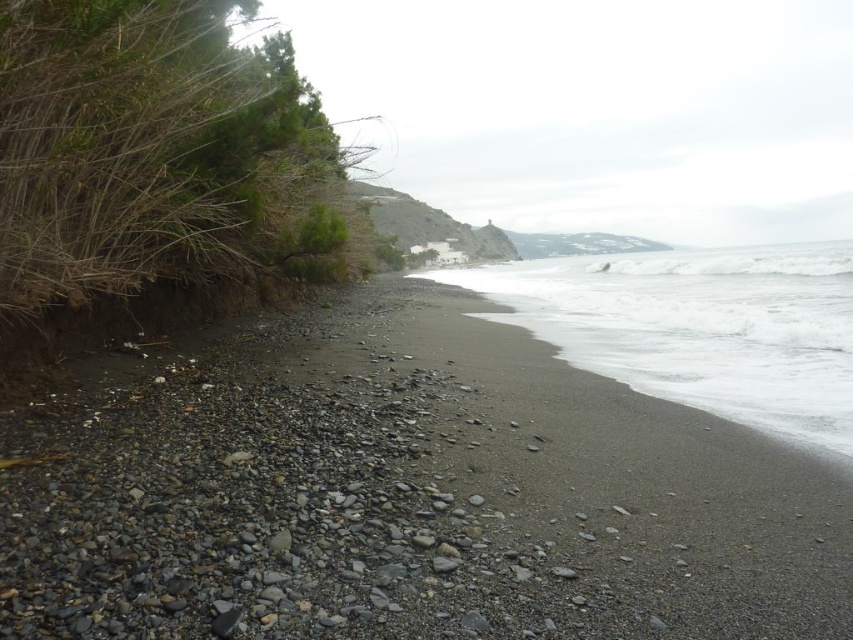
Question: Does smooth pebbles at lower left lie in front of white foamy water at lower right?

Choices:
 (A) no
 (B) yes

Answer: (A)

Question: Can you confirm if smooth pebbles at lower left is positioned to the right of white foamy water at lower right?

Choices:
 (A) yes
 (B) no

Answer: (B)

Question: Where is smooth pebbles at lower left located in relation to white foamy water at lower right in the image?

Choices:
 (A) above
 (B) below

Answer: (B)

Question: Among these points, which one is farthest from the camera?

Choices:
 (A) (664, 563)
 (B) (772, 403)

Answer: (B)